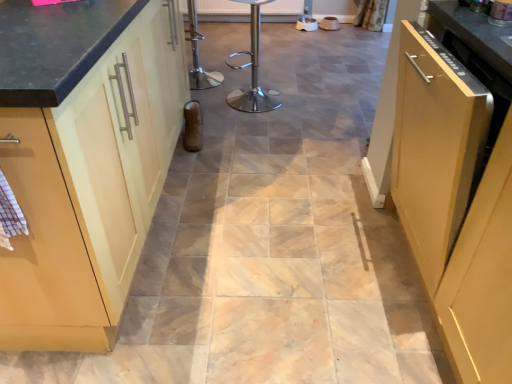
Question: Does matte wood cabinet at right, marked as the first cabinetry in a right-to-left arrangement, have a greater width compared to matte wood cabinet at left, the first cabinetry in the left-to-right sequence?

Choices:
 (A) no
 (B) yes

Answer: (A)

Question: Can you confirm if matte wood cabinet at right, marked as the first cabinetry in a right-to-left arrangement, is positioned to the left of matte wood cabinet at left, which is counted as the 2th cabinetry, starting from the right?

Choices:
 (A) no
 (B) yes

Answer: (A)

Question: Does matte wood cabinet at right, marked as the first cabinetry in a right-to-left arrangement, have a lesser width compared to matte wood cabinet at left, which is counted as the 2th cabinetry, starting from the right?

Choices:
 (A) no
 (B) yes

Answer: (B)

Question: Considering the relative positions of matte wood cabinet at right, marked as the second cabinetry in a left-to-right arrangement, and matte wood cabinet at left, which is counted as the 2th cabinetry, starting from the right, in the image provided, is matte wood cabinet at right, marked as the second cabinetry in a left-to-right arrangement, to the right of matte wood cabinet at left, which is counted as the 2th cabinetry, starting from the right, from the viewer's perspective?

Choices:
 (A) yes
 (B) no

Answer: (A)

Question: Is matte wood cabinet at right, marked as the first cabinetry in a right-to-left arrangement, oriented towards matte wood cabinet at left, which is counted as the 2th cabinetry, starting from the right?

Choices:
 (A) no
 (B) yes

Answer: (B)

Question: Does matte wood cabinet at right, marked as the second cabinetry in a left-to-right arrangement, touch matte wood cabinet at left, the first cabinetry in the left-to-right sequence?

Choices:
 (A) no
 (B) yes

Answer: (A)

Question: Is polished stainless steel bar stool at center positioned far away from matte wood cabinet at left, the first cabinetry in the left-to-right sequence?

Choices:
 (A) no
 (B) yes

Answer: (B)

Question: Can you confirm if polished stainless steel bar stool at center is thinner than matte wood cabinet at left, which is counted as the 2th cabinetry, starting from the right?

Choices:
 (A) no
 (B) yes

Answer: (B)

Question: Does polished stainless steel bar stool at center have a smaller size compared to matte wood cabinet at left, the first cabinetry in the left-to-right sequence?

Choices:
 (A) yes
 (B) no

Answer: (A)

Question: Is polished stainless steel bar stool at center shorter than matte wood cabinet at left, the first cabinetry in the left-to-right sequence?

Choices:
 (A) yes
 (B) no

Answer: (A)

Question: Is matte wood cabinet at left, the first cabinetry in the left-to-right sequence, surrounded by polished stainless steel bar stool at center?

Choices:
 (A) no
 (B) yes

Answer: (A)

Question: From a real-world perspective, is polished stainless steel bar stool at center beneath matte wood cabinet at left, which is counted as the 2th cabinetry, starting from the right?

Choices:
 (A) no
 (B) yes

Answer: (B)

Question: Considering the relative sizes of matte wood cabinet at left, the first cabinetry in the left-to-right sequence, and metallic silver dishwasher at upper right in the image provided, is matte wood cabinet at left, the first cabinetry in the left-to-right sequence, taller than metallic silver dishwasher at upper right?

Choices:
 (A) yes
 (B) no

Answer: (A)